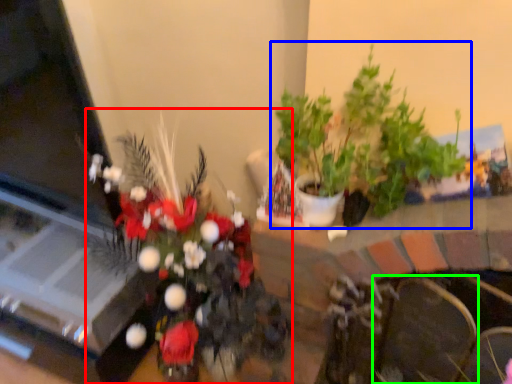
Question: Considering the real-world distances, which object is closest to houseplant (highlighted by a red box)? houseplant (highlighted by a blue box) or armchair (highlighted by a green box).

Choices:
 (A) houseplant
 (B) armchair

Answer: (A)